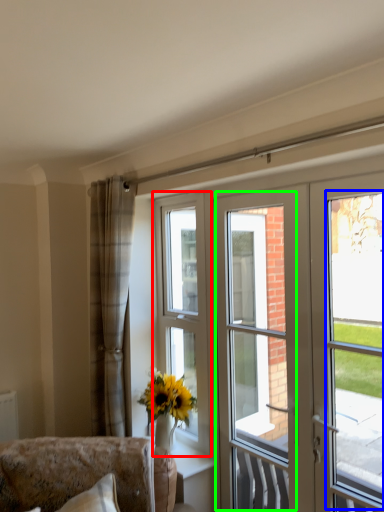
Question: Based on their relative distances, which object is farther from window (highlighted by a red box)? Choose from window screen (highlighted by a blue box) and screen door (highlighted by a green box).

Choices:
 (A) window screen
 (B) screen door

Answer: (B)